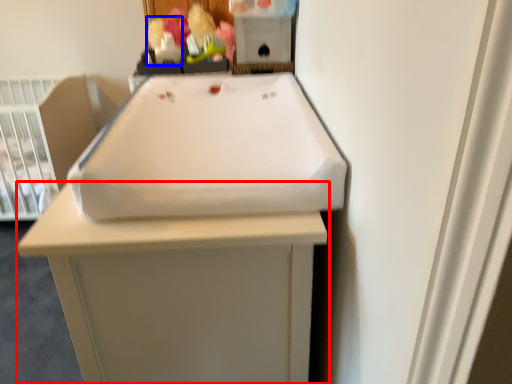
Question: Which of the following is the farthest to the observer, furniture (highlighted by a red box) or toy (highlighted by a blue box)?

Choices:
 (A) furniture
 (B) toy

Answer: (B)